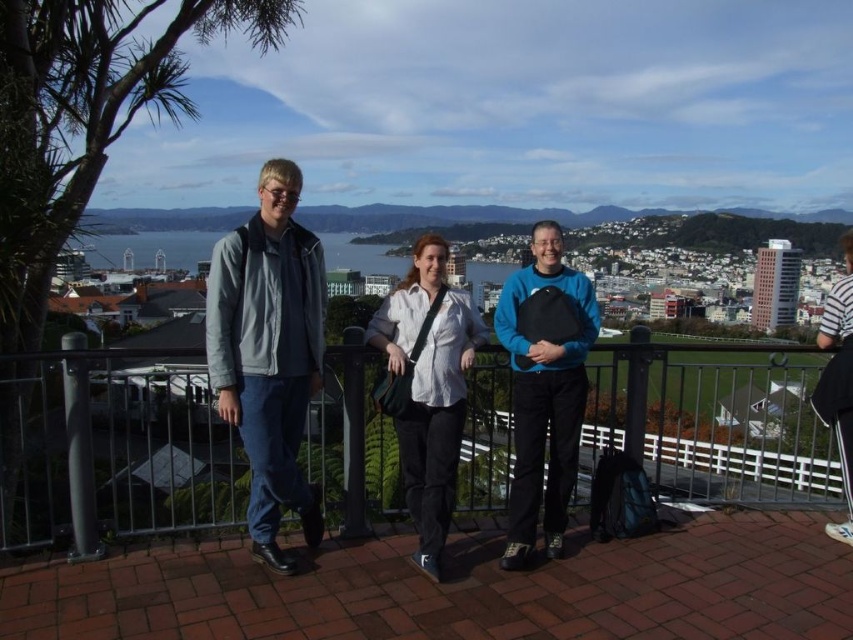
Between black metal railing at center and teal matte sweater at center, which one appears on the left side from the viewer's perspective?

Positioned to the left is teal matte sweater at center.

Is black metal railing at center closer to camera compared to teal matte sweater at center?

Yes, black metal railing at center is in front of teal matte sweater at center.

Does point (343, 368) come closer to viewer compared to point (546, 262)?

Yes, it is.

At what (x,y) coordinates should I click in order to perform the action: click on black metal railing at center. Please return your answer as a coordinate pair (x, y). Looking at the image, I should click on point(112,449).

At what (x,y) coordinates should I click in order to perform the action: click on black metal railing at center. Please return your answer as a coordinate pair (x, y). The image size is (853, 640). Looking at the image, I should click on (112, 449).

Is black metal railing at center wider than white striped shirt at upper right?

Correct, the width of black metal railing at center exceeds that of white striped shirt at upper right.

Is point (799, 432) in front of point (844, 305)?

That is False.

The height and width of the screenshot is (640, 853). In order to click on black metal railing at center in this screenshot , I will do `click(112, 449)`.

Locate an element on the screen. white cotton shirt at center is located at coordinates (x=428, y=387).

Between point (409, 368) and point (836, 410), which one is positioned behind?

The point (409, 368) is behind.

Identify the location of white cotton shirt at center. Image resolution: width=853 pixels, height=640 pixels. (428, 387).

The width and height of the screenshot is (853, 640). I want to click on white cotton shirt at center, so click(428, 387).